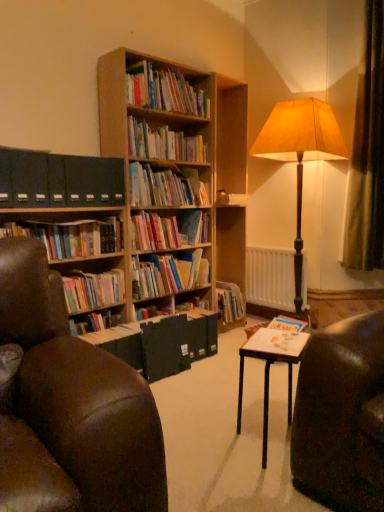
This screenshot has width=384, height=512. Identify the location of free space to the back side of wooden table at center. (243, 402).